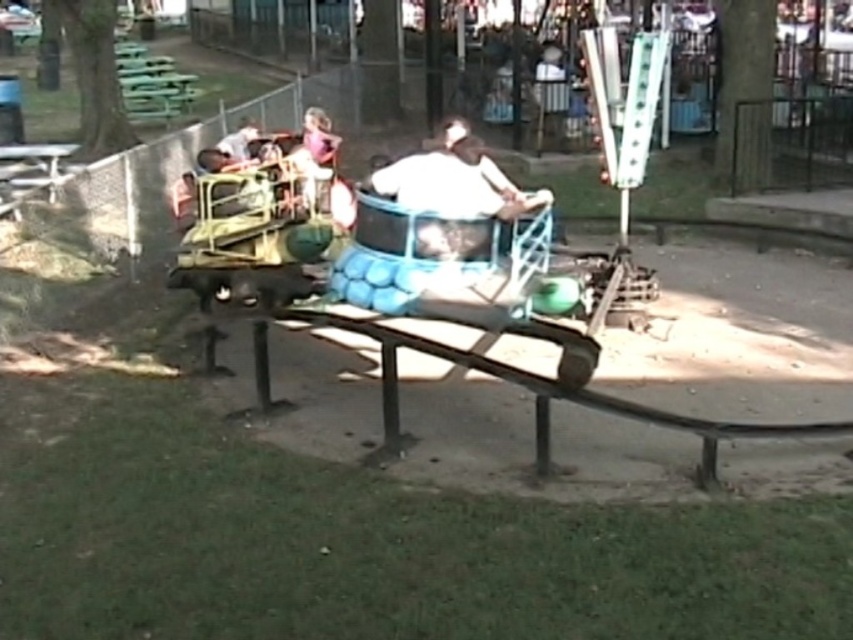
Question: Can you confirm if white matte shirt at center is thinner than matte purple shirt at center?

Choices:
 (A) no
 (B) yes

Answer: (A)

Question: Does white matte shirt at center come in front of matte purple shirt at center?

Choices:
 (A) yes
 (B) no

Answer: (A)

Question: Which point is farther to the camera?

Choices:
 (A) (387, 180)
 (B) (323, 157)

Answer: (B)

Question: Can you confirm if white matte shirt at center is positioned above matte purple shirt at center?

Choices:
 (A) yes
 (B) no

Answer: (B)

Question: Which of the following is the farthest from the observer?

Choices:
 (A) white matte shirt at center
 (B) matte purple shirt at center

Answer: (B)